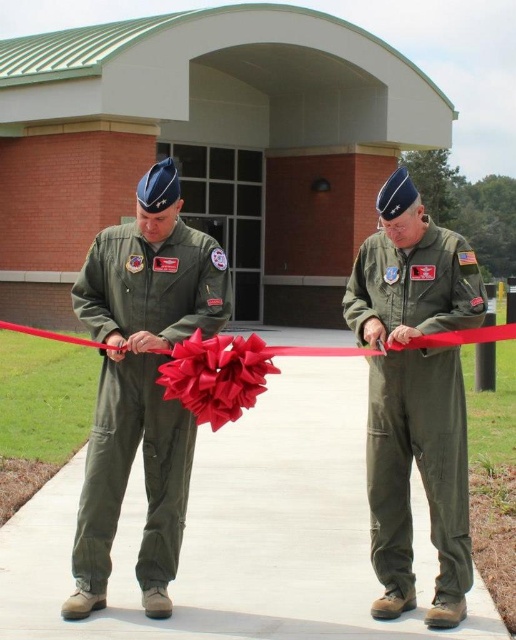
Based on the photo, you are a photographer at the ribbon cutting ceremony. You need to capture a photo where the green matte uniform at center and the red satin ribbon at center are both clearly visible. Based on their positions, which object should be focused on first to ensure both are in frame?

The green matte uniform at center is below the red satin ribbon at center, so focusing on the red satin ribbon at center first will ensure the green matte uniform at center is also in frame as it is positioned lower.

You are a photographer at the ribbon cutting ceremony. You want to take a photo of the red satin ribbon at center and the green matte uniform at center. Which object should you focus on first if you want to capture both in the frame without moving the camera?

The green matte uniform at center is positioned on the left side of the red satin ribbon at center, so you should focus on the green matte uniform at center first to ensure both are in frame without moving the camera.